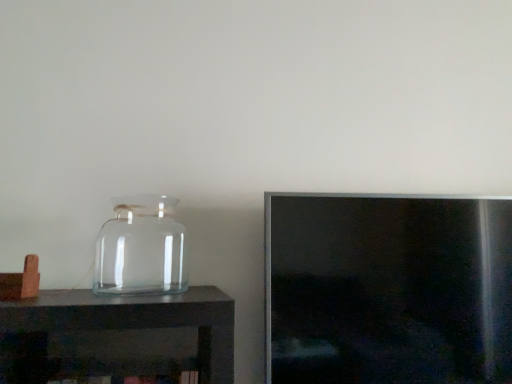
This screenshot has width=512, height=384. What do you see at coordinates (141, 248) in the screenshot?
I see `transparent glass jar at center` at bounding box center [141, 248].

You are a GUI agent. You are given a task and a screenshot of the screen. Output one action in this format:
    pyautogui.click(x=<x>, y=<y>)
    Task: Click on the transparent glass jar at center
    This screenshot has width=512, height=384.
    Given the screenshot: What is the action you would take?
    pyautogui.click(x=141, y=248)

Locate an element on the screen. transparent glass jar at center is located at coordinates (141, 248).